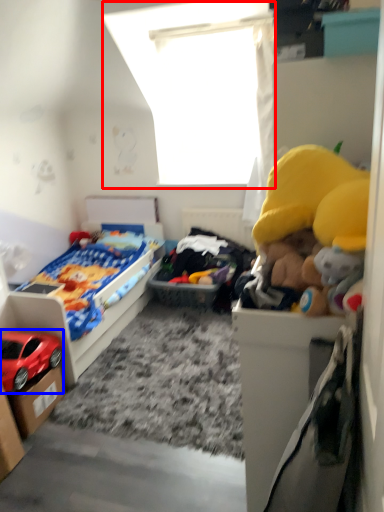
Question: Which object is closer to the camera taking this photo, window screen (highlighted by a red box) or car (highlighted by a blue box)?

Choices:
 (A) window screen
 (B) car

Answer: (B)